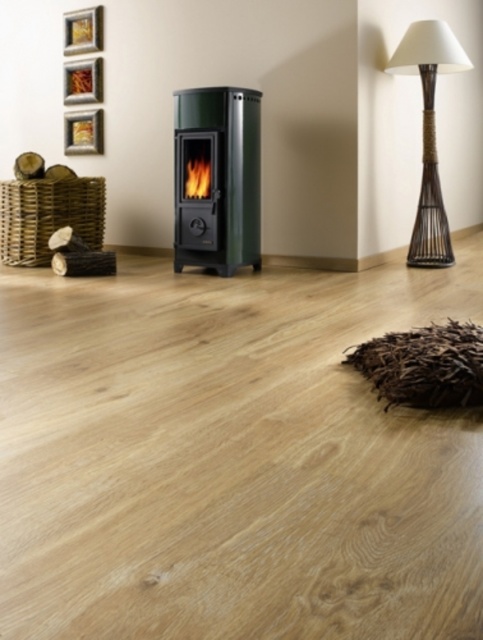
Is woven bamboo lamp at upper right positioned behind gold metallic picture frame at upper left?

No, it is not.

In the scene shown: Does woven bamboo lamp at upper right appear on the right side of gold metallic picture frame at upper left?

Indeed, woven bamboo lamp at upper right is positioned on the right side of gold metallic picture frame at upper left.

Is point (439, 204) behind point (82, 138)?

That is False.

You are a GUI agent. You are given a task and a screenshot of the screen. Output one action in this format:
    pyautogui.click(x=<x>, y=<y>)
    Task: Click on the woven bamboo lamp at upper right
    This screenshot has height=640, width=483.
    Given the screenshot: What is the action you would take?
    pyautogui.click(x=428, y=132)

In the scene shown: Who is taller, woven bamboo lamp at upper right or wooden picture frame at upper left?

woven bamboo lamp at upper right

Is woven bamboo lamp at upper right above wooden picture frame at upper left?

No.

Who is more distant from viewer, (426, 234) or (72, 32)?

Point (72, 32)

Where is `woven bamboo lamp at upper right`? Image resolution: width=483 pixels, height=640 pixels. woven bamboo lamp at upper right is located at coordinates (428, 132).

Who is lower down, green matte fireplace at center or woven bamboo lamp at upper right?

Positioned lower is green matte fireplace at center.

What are the coordinates of `green matte fireplace at center` in the screenshot? It's located at (216, 179).